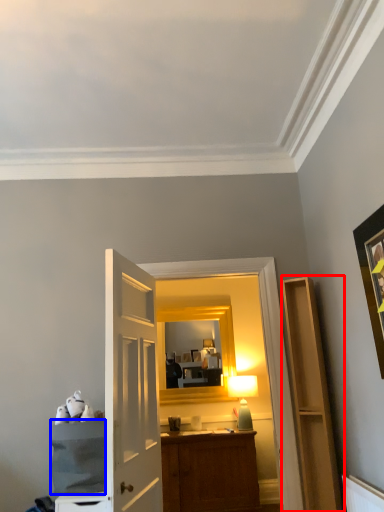
Question: Which object appears farthest to the camera in this image, cabinetry (highlighted by a red box) or cabinetry (highlighted by a blue box)?

Choices:
 (A) cabinetry
 (B) cabinetry

Answer: (A)